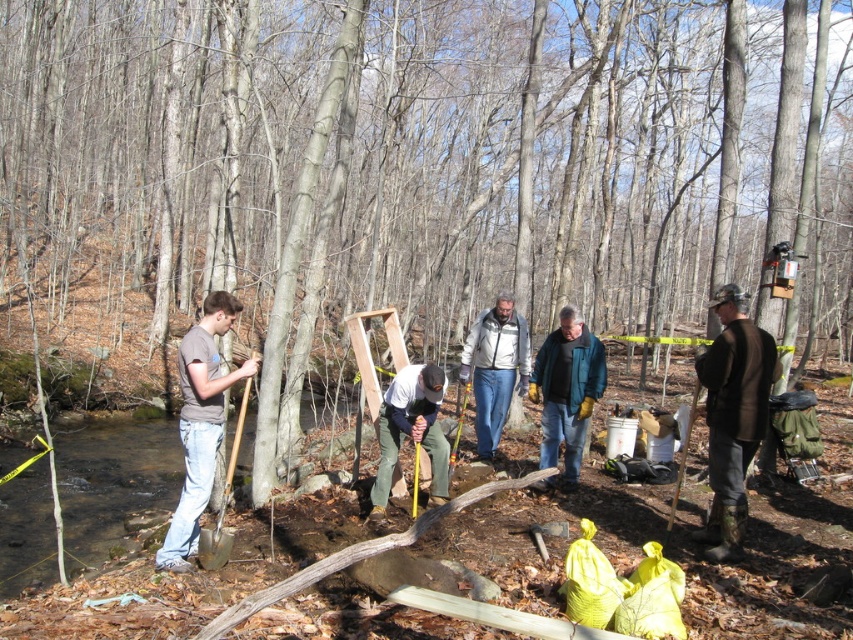
Is matte white shirt at center positioned before wooden shovel at left?

That is False.

Is point (444, 372) closer to viewer compared to point (229, 460)?

Yes, point (444, 372) is closer to viewer.

Does point (439, 467) come farther from viewer compared to point (228, 477)?

Yes, it is behind point (228, 477).

The image size is (853, 640). Find the location of `matte white shirt at center`. matte white shirt at center is located at coordinates (410, 429).

Does brown leather jacket at right come behind teal jacket at center?

That is False.

Does brown leather jacket at right have a greater height compared to teal jacket at center?

Correct, brown leather jacket at right is much taller as teal jacket at center.

Where is `brown leather jacket at right`? Image resolution: width=853 pixels, height=640 pixels. brown leather jacket at right is located at coordinates (733, 417).

Identify the location of brown leather jacket at right. (733, 417).

Which is below, brown cotton t-shirt at left or teal jacket at center?

teal jacket at center is lower down.

Who is more forward, (186, 509) or (544, 356)?

Point (186, 509) is more forward.

Identify the location of brown cotton t-shirt at left. (200, 422).